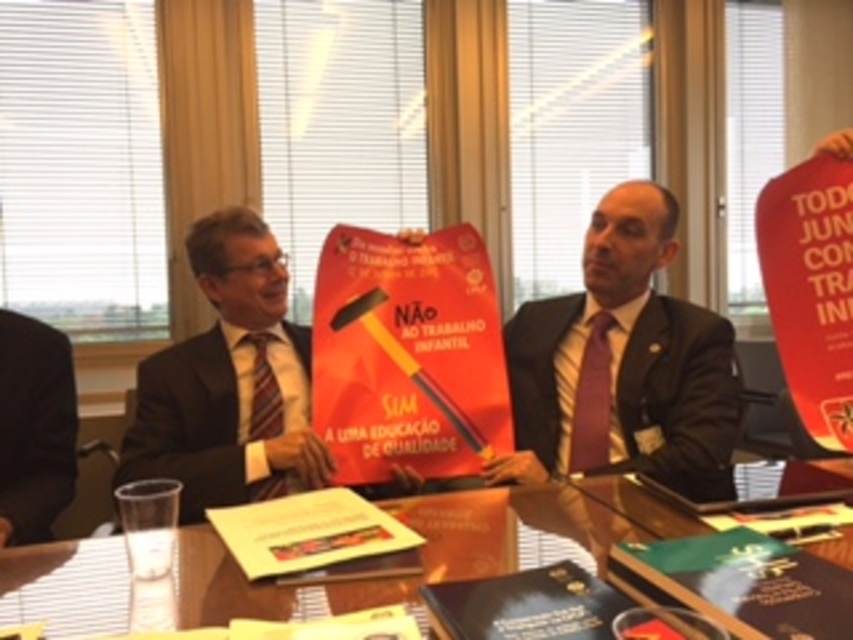
From the picture: You are organizing a bookshelf and need to stack the green matte book at lower right and the hardcover book at center vertically. Which book should you place at the bottom to ensure stability?

The green matte book at lower right should be placed at the bottom since it has a greater height than the hardcover book at center, providing a more stable base.

Based on the photo, you are organizing a presentation and need to place a 10 cm wide name tag on the table. Given the presence of the matte black suit at center and the yellow paper at center, which object should you place the name tag next to to ensure it fits without overlapping?

The yellow paper at center has a smaller width than the matte black suit at center, so placing the name tag next to the yellow paper at center would provide enough space to fit the 10 cm wide name tag without overlapping.

You are organizing a presentation and need to place the yellow paper at center and the maroon striped tie at center on a table. Based on their sizes, which one should you place first to ensure they both fit?

The yellow paper at center might be wider than the maroon striped tie at center, so you should place the maroon striped tie at center first to ensure both fit on the table.